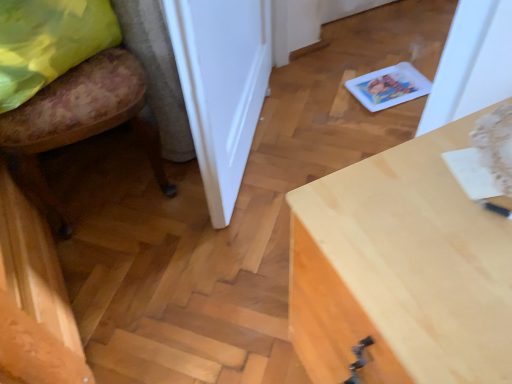
Question: Is light wood desk at center turned away from floral fabric chair at lower left?

Choices:
 (A) yes
 (B) no

Answer: (B)

Question: Is light wood desk at center positioned beyond the bounds of floral fabric chair at lower left?

Choices:
 (A) yes
 (B) no

Answer: (A)

Question: Is light wood desk at center further to the viewer compared to floral fabric chair at lower left?

Choices:
 (A) yes
 (B) no

Answer: (B)

Question: From a real-world perspective, is light wood desk at center below floral fabric chair at lower left?

Choices:
 (A) yes
 (B) no

Answer: (A)

Question: Can you confirm if light wood desk at center is thinner than floral fabric chair at lower left?

Choices:
 (A) yes
 (B) no

Answer: (B)

Question: Is light wood desk at center taller or shorter than yellow fabric pillow at left?

Choices:
 (A) short
 (B) tall

Answer: (B)

Question: Is light wood desk at center wider or thinner than yellow fabric pillow at left?

Choices:
 (A) thin
 (B) wide

Answer: (B)

Question: Choose the correct answer: Is light wood desk at center inside yellow fabric pillow at left or outside it?

Choices:
 (A) outside
 (B) inside

Answer: (A)

Question: From a real-world perspective, relative to yellow fabric pillow at left, is light wood desk at center vertically above or below?

Choices:
 (A) below
 (B) above

Answer: (A)

Question: Is white glossy door at center bigger or smaller than floral fabric chair at lower left?

Choices:
 (A) small
 (B) big

Answer: (A)

Question: From a real-world perspective, is white glossy door at center physically located above or below floral fabric chair at lower left?

Choices:
 (A) above
 (B) below

Answer: (A)

Question: Considering the positions of white glossy door at center and floral fabric chair at lower left in the image, is white glossy door at center wider or thinner than floral fabric chair at lower left?

Choices:
 (A) wide
 (B) thin

Answer: (B)

Question: Considering their positions, is white glossy door at center located in front of or behind floral fabric chair at lower left?

Choices:
 (A) behind
 (B) front

Answer: (B)

Question: From a real-world perspective, is white glossy door at center positioned above or below yellow fabric pillow at left?

Choices:
 (A) below
 (B) above

Answer: (A)

Question: Is point (202, 147) closer or farther from the camera than point (80, 51)?

Choices:
 (A) closer
 (B) farther

Answer: (A)